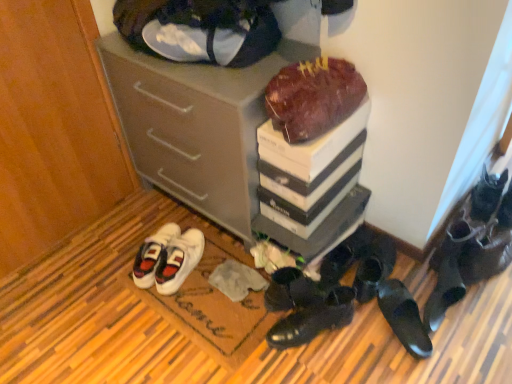
Find the location of a particular element. free space in front of black leather shoes at lower right, the 2th footwear when ordered from right to left is located at coordinates (492, 306).